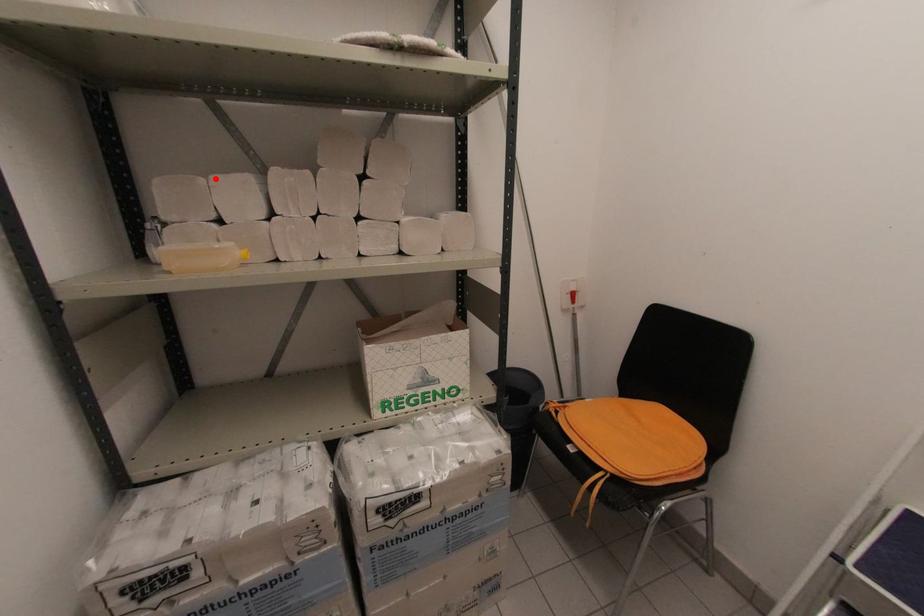
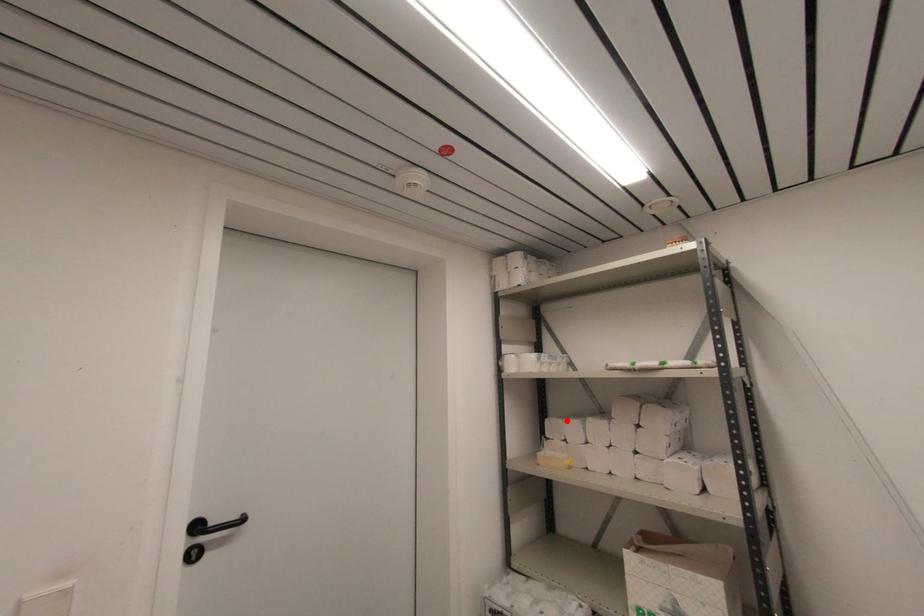
I am providing you with two images of the same scene from different viewpoints. A red point is marked on the first image and another point is marked on the second image. Do the highlighted points in image1 and image2 indicate the same real-world spot?

Yes